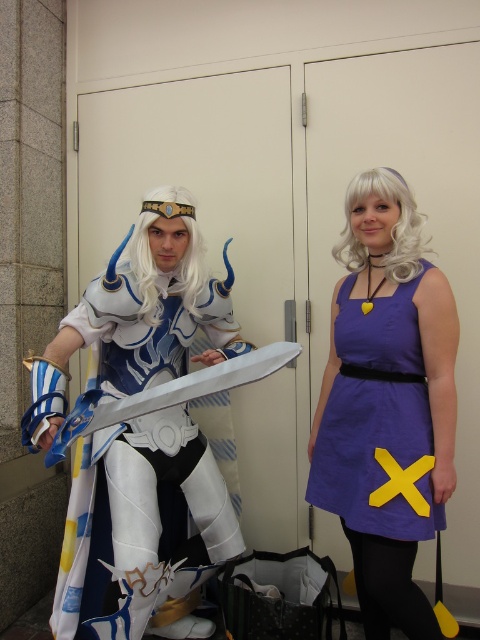
Question: Does purple fabric dress at center appear on the right side of white glossy armor at center?

Choices:
 (A) yes
 (B) no

Answer: (A)

Question: Which of the following is the farthest from the observer?

Choices:
 (A) white glossy armor at center
 (B) purple fabric dress at center

Answer: (B)

Question: Which of the following is the closest to the observer?

Choices:
 (A) purple fabric dress at center
 (B) white glossy armor at center

Answer: (B)

Question: Does purple fabric dress at center appear under white glossy armor at center?

Choices:
 (A) no
 (B) yes

Answer: (A)

Question: Can you confirm if purple fabric dress at center is wider than white glossy armor at center?

Choices:
 (A) no
 (B) yes

Answer: (A)